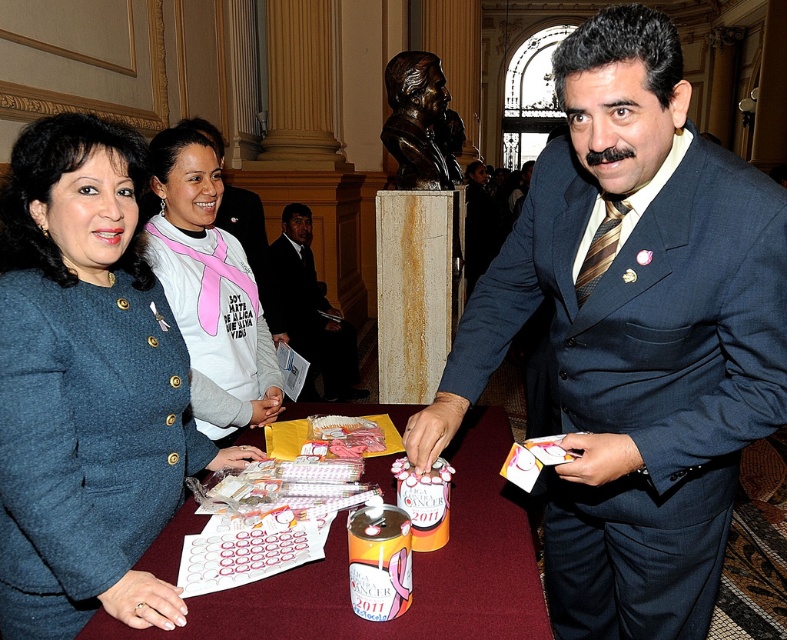
You are standing in the grand hall and see the white paper at center. Can you estimate its location using coordinates?

The white paper at center is located at coordinates point [412,572].

You are standing in the grand hall and see the matte blue coat at center and the pink fabric shirt at center. Which one is nearer to you?

The matte blue coat at center is closer to the viewer than the pink fabric shirt at center.